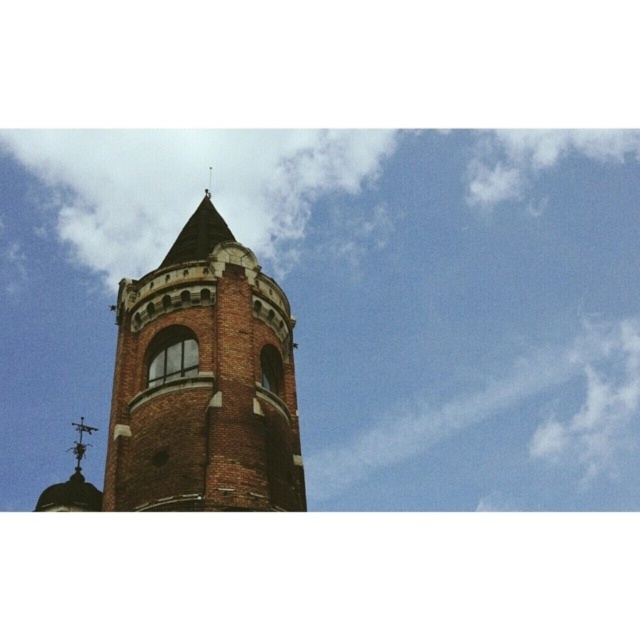
Between white fluffy cloud at upper center and polished metal spire at upper center, which one has more height?

white fluffy cloud at upper center

Is white fluffy cloud at upper center to the left of polished metal spire at upper center from the viewer's perspective?

No, white fluffy cloud at upper center is not to the left of polished metal spire at upper center.

This screenshot has height=640, width=640. What do you see at coordinates (355, 300) in the screenshot?
I see `white fluffy cloud at upper center` at bounding box center [355, 300].

This screenshot has height=640, width=640. I want to click on white fluffy cloud at upper center, so click(x=355, y=300).

Does white fluffy cloud at upper center appear under brick tower at center?

Indeed, white fluffy cloud at upper center is positioned under brick tower at center.

Does white fluffy cloud at upper center appear on the right side of brick tower at center?

Correct, you'll find white fluffy cloud at upper center to the right of brick tower at center.

Does point (576, 205) come closer to viewer compared to point (184, 404)?

No, (576, 205) is further to viewer.

Identify the location of white fluffy cloud at upper center. The height and width of the screenshot is (640, 640). (355, 300).

Who is positioned more to the left, brick tower at center or polished metal spire at upper center?

polished metal spire at upper center

Between point (221, 390) and point (93, 428), which one is positioned behind?

The point (93, 428) is behind.

Find the location of a particular element. The height and width of the screenshot is (640, 640). brick tower at center is located at coordinates (204, 381).